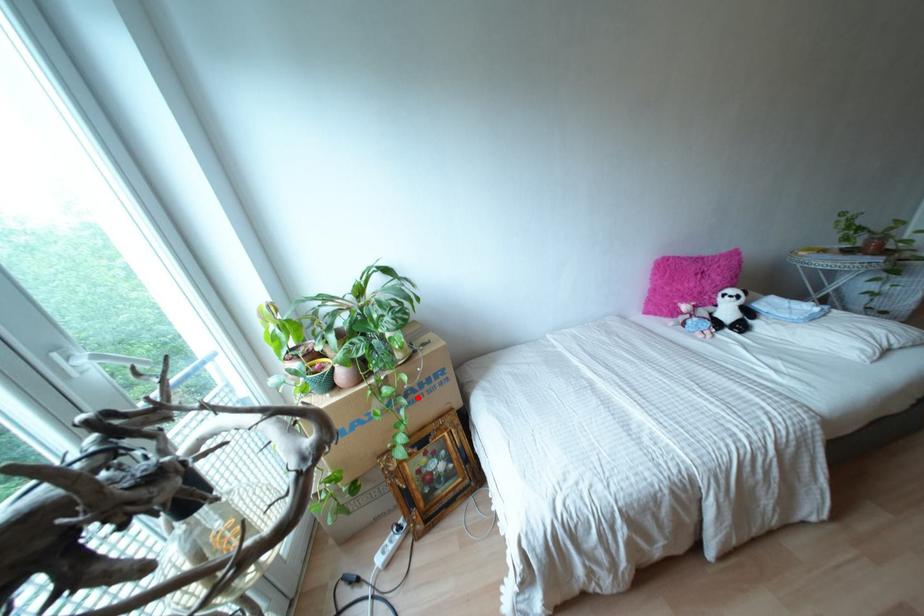
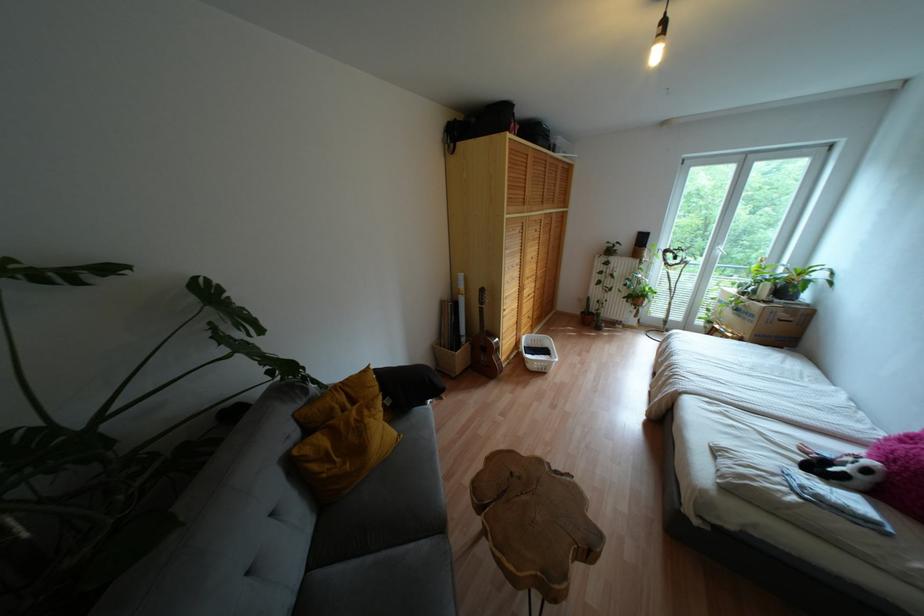
The point at the highlighted location is marked in the first image. Where is the corresponding point in the second image?

(737, 315)